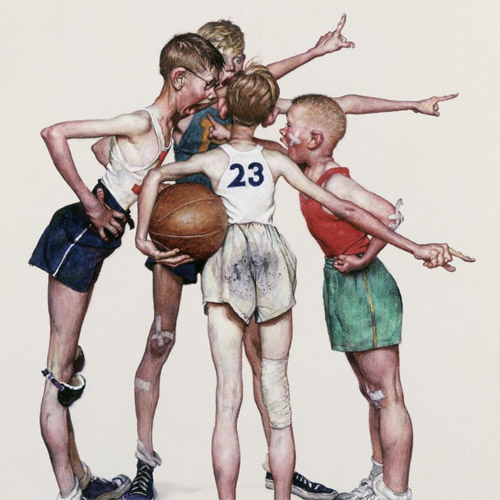
At what (x,y) coordinates should I click in order to perform the action: click on sock. Please return your answer as a coordinate pair (x, y). The height and width of the screenshot is (500, 500). Looking at the image, I should click on (143, 455).